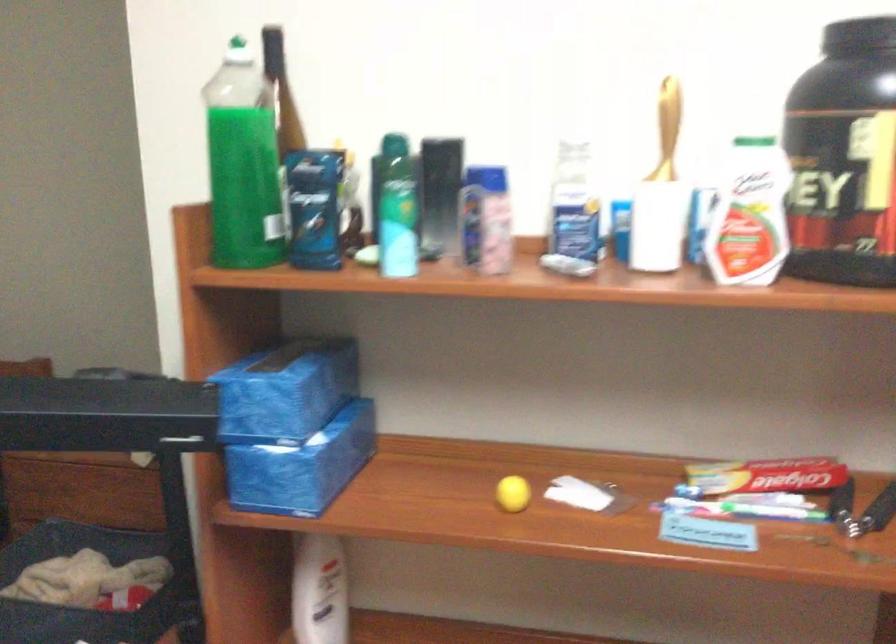
Where would you lift the small yellow ball? Please return your answer as a coordinate pair (x, y).

(513, 494)